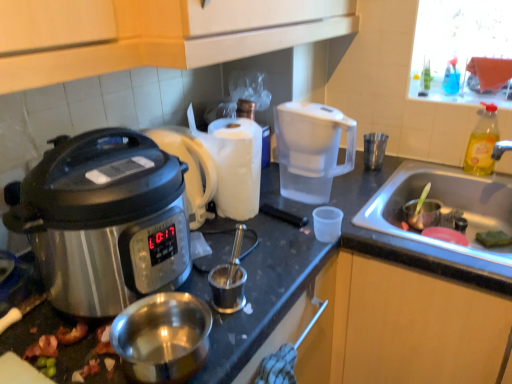
Question: Does transparent plastic water filter pitcher at center-right lie in front of stainless steel sink at lower right?

Choices:
 (A) no
 (B) yes

Answer: (A)

Question: Is stainless steel sink at lower right located within transparent plastic water filter pitcher at center-right?

Choices:
 (A) yes
 (B) no

Answer: (B)

Question: Is transparent plastic water filter pitcher at center-right directly adjacent to stainless steel sink at lower right?

Choices:
 (A) no
 (B) yes

Answer: (A)

Question: Considering the relative sizes of transparent plastic water filter pitcher at center-right and stainless steel sink at lower right in the image provided, is transparent plastic water filter pitcher at center-right shorter than stainless steel sink at lower right?

Choices:
 (A) yes
 (B) no

Answer: (B)

Question: Is transparent plastic water filter pitcher at center-right not within stainless steel sink at lower right?

Choices:
 (A) yes
 (B) no

Answer: (A)

Question: From a real-world perspective, is stainless steel slow cooker at left above or below stainless steel sink at lower right?

Choices:
 (A) above
 (B) below

Answer: (A)

Question: Considering the positions of point (73, 165) and point (470, 246), is point (73, 165) closer or farther from the camera than point (470, 246)?

Choices:
 (A) farther
 (B) closer

Answer: (B)

Question: Is stainless steel slow cooker at left in front of or behind stainless steel sink at lower right in the image?

Choices:
 (A) front
 (B) behind

Answer: (A)

Question: Choose the correct answer: Is stainless steel slow cooker at left inside stainless steel sink at lower right or outside it?

Choices:
 (A) inside
 (B) outside

Answer: (B)

Question: Is stainless steel slow cooker at left taller or shorter than shiny metallic bacon at lower left?

Choices:
 (A) short
 (B) tall

Answer: (B)

Question: From a real-world perspective, relative to shiny metallic bacon at lower left, is stainless steel slow cooker at left vertically above or below?

Choices:
 (A) below
 (B) above

Answer: (B)

Question: Relative to shiny metallic bacon at lower left, is stainless steel slow cooker at left in front or behind?

Choices:
 (A) front
 (B) behind

Answer: (A)

Question: Considering the positions of point (72, 236) and point (97, 370), is point (72, 236) closer or farther from the camera than point (97, 370)?

Choices:
 (A) farther
 (B) closer

Answer: (B)

Question: Is point (489, 104) closer or farther from the camera than point (315, 157)?

Choices:
 (A) closer
 (B) farther

Answer: (B)

Question: Is yellow translucent bottle at sink right, marked as the 2th bottle in a top-to-bottom arrangement, wider or thinner than transparent plastic water filter pitcher at center-right?

Choices:
 (A) thin
 (B) wide

Answer: (A)